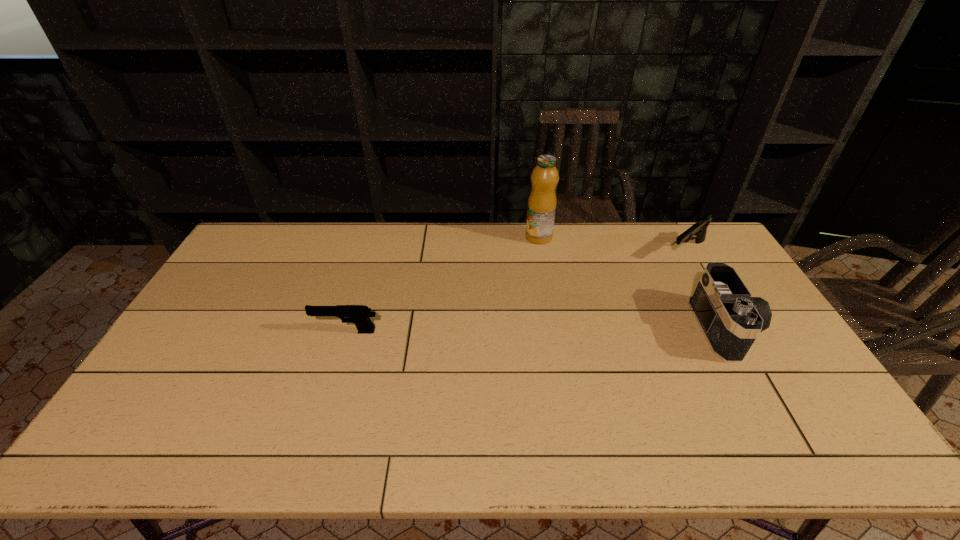
Where is `vacant space at the far edge of the desktop`? Image resolution: width=960 pixels, height=540 pixels. vacant space at the far edge of the desktop is located at coordinates (614, 244).

Locate an element on the screen. This screenshot has width=960, height=540. free point at the near edge is located at coordinates (447, 407).

Image resolution: width=960 pixels, height=540 pixels. In order to click on free location at the right edge in this screenshot , I will do `click(760, 347)`.

Locate an element on the screen. This screenshot has height=540, width=960. vacant space at the far left corner of the desktop is located at coordinates (290, 229).

In the image, there is a desktop. Where is `free space at the far right corner`? free space at the far right corner is located at coordinates (669, 225).

The height and width of the screenshot is (540, 960). In order to click on free spot between the leftmost object and the tallest object in this screenshot , I will do `click(443, 284)`.

This screenshot has height=540, width=960. In order to click on unoccupied position between the tallest object and the gun in this screenshot , I will do `click(612, 244)`.

This screenshot has width=960, height=540. What are the coordinates of `unoccupied position between the leftmost object and the gun` in the screenshot? It's located at (516, 291).

At what (x,y) coordinates should I click in order to perform the action: click on free space between the tallest object and the gun. Please return your answer as a coordinate pair (x, y). Looking at the image, I should click on (612, 244).

At what (x,y) coordinates should I click in order to perform the action: click on vacant area that lies between the fruit juice and the gun. Please return your answer as a coordinate pair (x, y). The image size is (960, 540). Looking at the image, I should click on (612, 244).